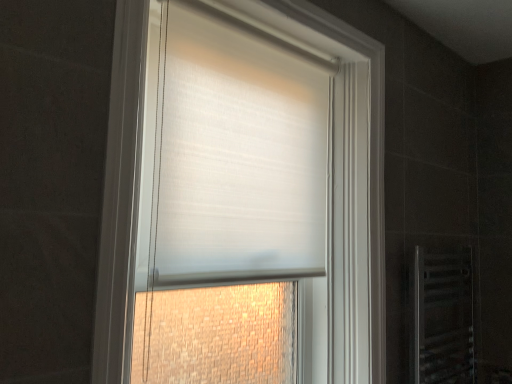
Question: From a real-world perspective, relative to white sheer blind at center, is white matte roller blind at center vertically above or below?

Choices:
 (A) above
 (B) below

Answer: (B)

Question: Is white matte roller blind at center wider or thinner than white sheer blind at center?

Choices:
 (A) thin
 (B) wide

Answer: (B)

Question: Estimate the real-world distances between objects in this image. Which object is closer to the white sheer blind at center?

Choices:
 (A) white matte roller blind at center
 (B) clear plastic screen door at lower right

Answer: (A)

Question: Estimate the real-world distances between objects in this image. Which object is farther from the white matte roller blind at center?

Choices:
 (A) clear plastic screen door at lower right
 (B) white sheer blind at center

Answer: (A)